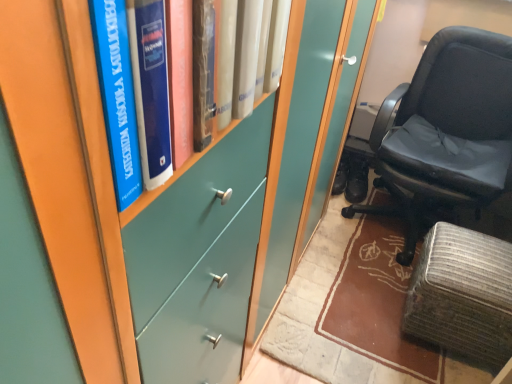
In order to face blue hardcover book at left, should I rotate leftwards or rightwards?

You should look left and rotate roughly 6.302 degrees.

What do you see at coordinates (447, 130) in the screenshot?
I see `black leather chair at right` at bounding box center [447, 130].

At what (x,y) coordinates should I click in order to perform the action: click on blue hardcover book at left. Please return your answer as a coordinate pair (x, y). Looking at the image, I should click on (132, 93).

Is textured gray ottoman at lower right bigger or smaller than black leather chair at right?

In the image, textured gray ottoman at lower right appears to be smaller than black leather chair at right.

Would you say textured gray ottoman at lower right is a long distance from black leather chair at right?

That's not correct — textured gray ottoman at lower right is a little close to black leather chair at right.

Can black leather chair at right be found inside textured gray ottoman at lower right?

Actually, black leather chair at right is outside textured gray ottoman at lower right.

From a real-world perspective, which is physically above, textured gray ottoman at lower right or black leather chair at right?

From a 3D spatial view, black leather chair at right is above.

Which is less distant, (154, 146) or (482, 330)?

Point (154, 146) is closer to the camera than point (482, 330).

Is blue hardcover book at left next to textured gray ottoman at lower right?

They are not placed beside each other.

Can you confirm if blue hardcover book at left is smaller than textured gray ottoman at lower right?

Indeed, blue hardcover book at left has a smaller size compared to textured gray ottoman at lower right.

Does blue hardcover book at left turn towards textured gray ottoman at lower right?

No, blue hardcover book at left is not facing towards textured gray ottoman at lower right.

From the image's perspective, which one is positioned lower, black leather chair at right or textured gray ottoman at lower right?

textured gray ottoman at lower right appears lower in the image.

From a real-world perspective, is black leather chair at right beneath textured gray ottoman at lower right?

Actually, black leather chair at right is physically above textured gray ottoman at lower right in the real world.

Is black leather chair at right not near textured gray ottoman at lower right?

That's not correct — black leather chair at right is a little close to textured gray ottoman at lower right.

From the image's perspective, is black leather chair at right located above or below blue hardcover book at left?

black leather chair at right is situated higher than blue hardcover book at left in the image.

Does black leather chair at right appear on the left side of blue hardcover book at left?

No.

Which object is thinner, black leather chair at right or blue hardcover book at left?

blue hardcover book at left.

Is black leather chair at right outside of blue hardcover book at left?

Absolutely, black leather chair at right is external to blue hardcover book at left.

Is blue hardcover book at left at the right side of black leather chair at right?

In fact, blue hardcover book at left is to the left of black leather chair at right.

From the image's perspective, which is above, blue hardcover book at left or black leather chair at right?

black leather chair at right.

Would you say blue hardcover book at left is inside or outside black leather chair at right?

blue hardcover book at left is not inside black leather chair at right, it's outside.

Is textured gray ottoman at lower right far from blue hardcover book at left?

Yes, textured gray ottoman at lower right is far from blue hardcover book at left.

Based on the photo, is the position of textured gray ottoman at lower right less distant than that of blue hardcover book at left?

That is False.

From a real-world perspective, is textured gray ottoman at lower right positioned over blue hardcover book at left based on gravity?

No, from a real-world perspective, textured gray ottoman at lower right is not on top of blue hardcover book at left.

At what (x,y) coordinates should I click in order to perform the action: click on furniture below the black leather chair at right (from the image's perspective). Please return your answer as a coordinate pair (x, y). The image size is (512, 384). Looking at the image, I should click on (462, 294).

Locate an element on the screen. book on the left of textured gray ottoman at lower right is located at coordinates (132, 93).

When comparing their distances from blue hardcover book at left, does textured gray ottoman at lower right or black leather chair at right seem further?

Among the two, black leather chair at right is located further to blue hardcover book at left.

From the image, which object appears to be nearer to black leather chair at right, textured gray ottoman at lower right or blue hardcover book at left?

textured gray ottoman at lower right is positioned closer to the anchor black leather chair at right.

When comparing their distances from textured gray ottoman at lower right, does blue hardcover book at left or black leather chair at right seem further?

blue hardcover book at left is further to textured gray ottoman at lower right.

When comparing their distances from textured gray ottoman at lower right, does black leather chair at right or blue hardcover book at left seem closer?

The object closer to textured gray ottoman at lower right is black leather chair at right.

When comparing their distances from black leather chair at right, does blue hardcover book at left or textured gray ottoman at lower right seem further?

blue hardcover book at left lies further to black leather chair at right than the other object.

When comparing their distances from blue hardcover book at left, does black leather chair at right or textured gray ottoman at lower right seem further?

Based on the image, black leather chair at right appears to be further to blue hardcover book at left.

Where is `chair positioned between blue hardcover book at left and textured gray ottoman at lower right from near to far`? chair positioned between blue hardcover book at left and textured gray ottoman at lower right from near to far is located at coordinates (447, 130).